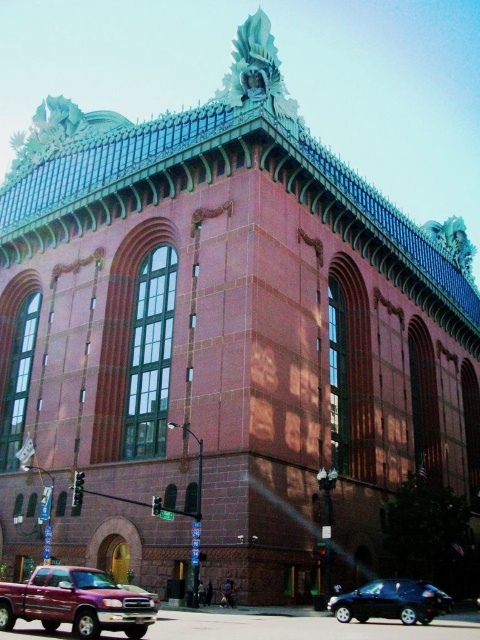
You are standing at the center of the image. Which direction should you move to reach the metallic maroon pickup truck at lower left?

You should move to the lower left direction to reach the metallic maroon pickup truck at lower left since it is located at point (76,602) which is lower left in the image coordinate system.

From the picture: You are a parking attendant and need to allocate space for both the metallic maroon pickup truck at lower left and the shiny black car at lower right. Given their sizes, which vehicle requires more space to park?

The metallic maroon pickup truck at lower left requires more space to park because its width is larger than the shiny black car at lower right.

You are a pedestrian standing in the middle of the road looking at the scene. Which vehicle is closer to you, the metallic maroon pickup truck at lower left or the shiny black car at lower right?

The metallic maroon pickup truck at lower left is located above the shiny black car at lower right, so the shiny black car at lower right is closer to you since it is below the truck.